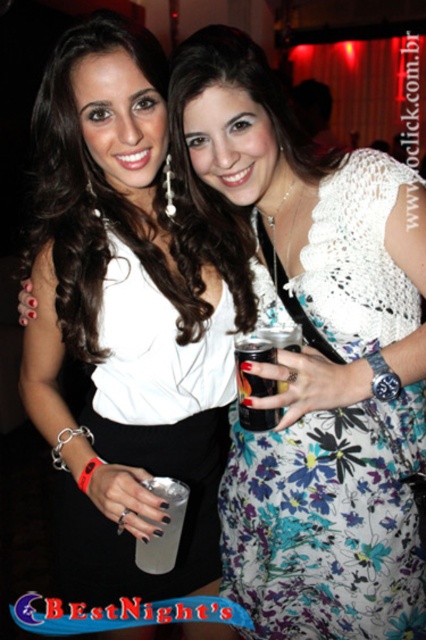
Question: Can you confirm if white matte dress at center is wider than floral print dress at center?

Choices:
 (A) yes
 (B) no

Answer: (A)

Question: From the image, what is the correct spatial relationship of white matte dress at center in relation to floral print dress at center?

Choices:
 (A) right
 (B) left

Answer: (B)

Question: Which point is closer to the camera?

Choices:
 (A) white matte dress at center
 (B) clear plastic cup at center

Answer: (B)

Question: Can you confirm if white matte dress at center is smaller than clear plastic cup at center?

Choices:
 (A) no
 (B) yes

Answer: (A)

Question: Which of these objects is positioned farthest from the white matte dress at center?

Choices:
 (A) clear plastic cup at center
 (B) floral print dress at center

Answer: (A)

Question: Estimate the real-world distances between objects in this image. Which object is farther from the floral print dress at center?

Choices:
 (A) clear plastic cup at center
 (B) white matte dress at center

Answer: (A)